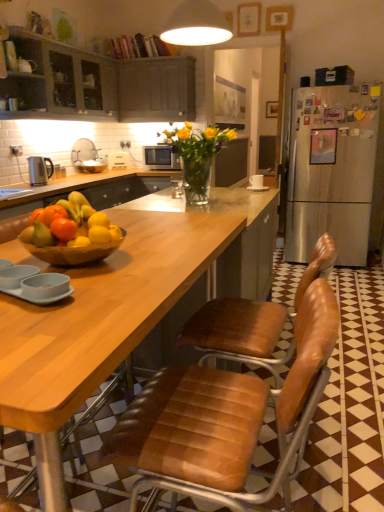
Question: From a real-world perspective, is orange matte at center above or below matte gray cabinets at upper left, placed as the first cabinetry when sorted from left to right?

Choices:
 (A) above
 (B) below

Answer: (B)

Question: Relative to matte gray cabinets at upper left, the 2th cabinetry when ordered from right to left, is orange matte at center in front or behind?

Choices:
 (A) front
 (B) behind

Answer: (A)

Question: Estimate the real-world distances between objects in this image. Which object is farther from the matte gray cabinets at upper left, placed as the first cabinetry when sorted from left to right?

Choices:
 (A) translucent glass vase at center
 (B) matte white sink at upper left
 (C) polished stainless steel kettle at left
 (D) orange matte at center
 (E) wooden bowl at center

Answer: (D)

Question: Estimate the real-world distances between objects in this image. Which object is farther from the matte gray cabinets at upper left, placed as the first cabinetry when sorted from left to right?

Choices:
 (A) silver metallic microwave at center
 (B) dark gray wood cabinet at upper center, which is the second cabinetry in left-to-right order
 (C) wooden bowl at center
 (D) matte white sink at upper left
 (E) brown leather chair at center

Answer: (E)